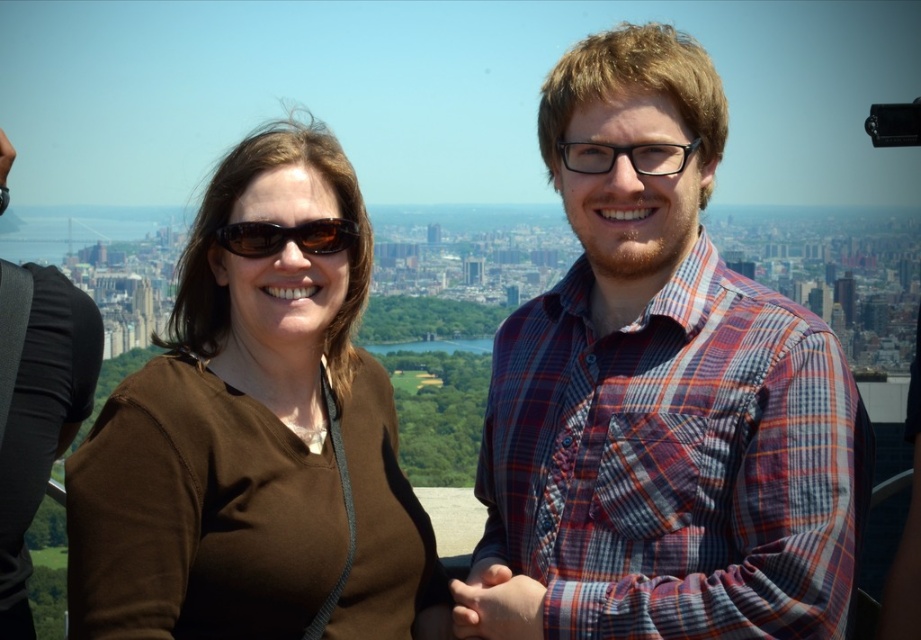
In the scene shown: You are a photographer trying to determine the order of the subjects in the photo. Which subject is positioned to the right of the other? The options are the plaid shirt at center and the brown matte shirt at center.

The plaid shirt at center is positioned on the right side of the brown matte shirt at center.

You are a photographer trying to capture a closeup shot of the plaid shirt at center and the matte brown sunglasses at center. Since you want both items to appear equally prominent in the photo, which object should you zoom in on more?

The plaid shirt at center has a larger size compared to matte brown sunglasses at center, so you should zoom in more on the matte brown sunglasses at center to make them appear larger and balance their prominence with the plaid shirt at center.